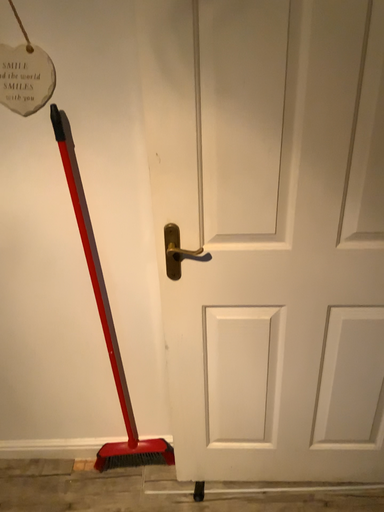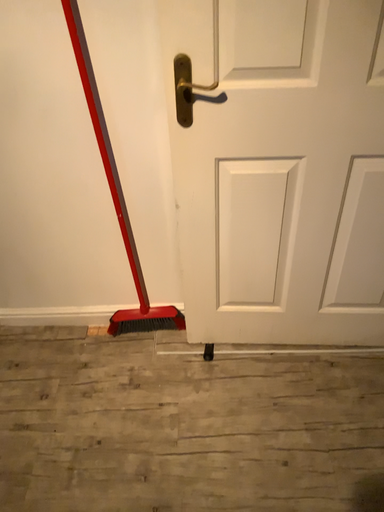
Question: How did the camera likely rotate when shooting the video?

Choices:
 (A) rotated downward
 (B) rotated upward

Answer: (A)